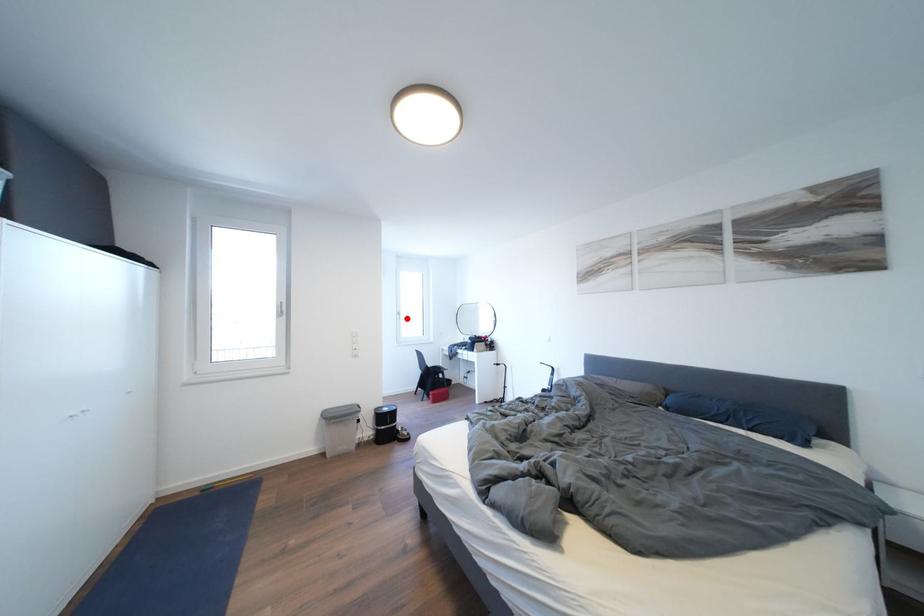
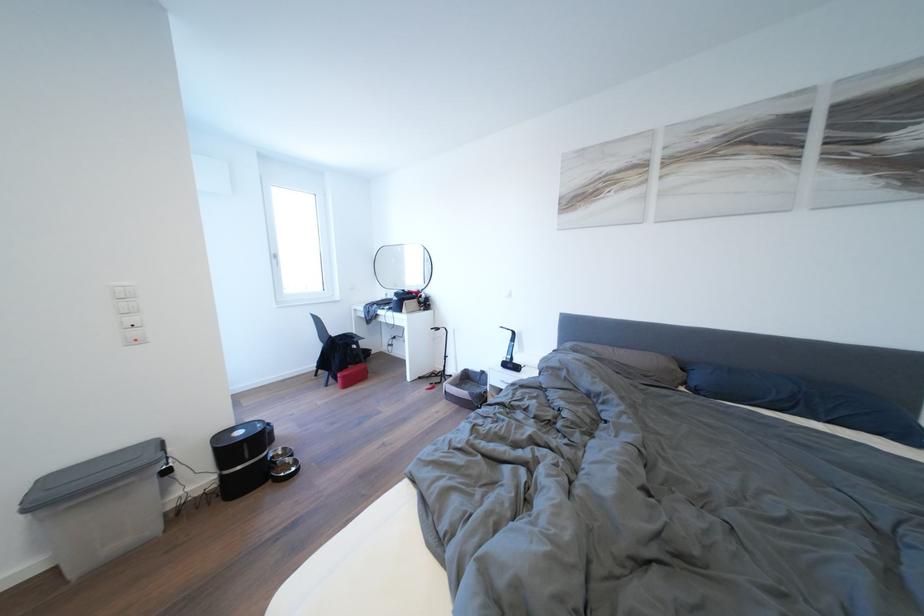
Question: A red point is marked in image1. In image2, is the corresponding 3D point closer to the camera or farther? Reply with the corresponding letter.

Choices:
 (A) The corresponding 3D point is closer.
 (B) The corresponding 3D point is farther.

Answer: (A)